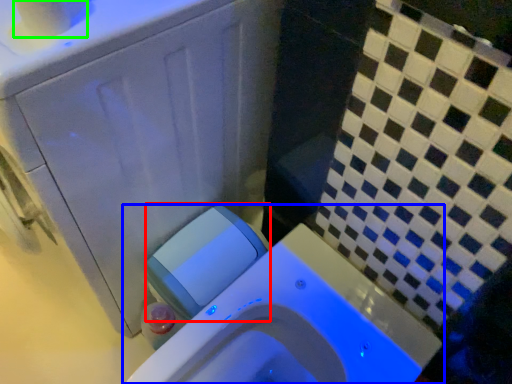
Question: Considering the real-world distances, which object is farthest from water tank (highlighted by a red box)? toilet (highlighted by a blue box) or toilet paper (highlighted by a green box)?

Choices:
 (A) toilet
 (B) toilet paper

Answer: (B)